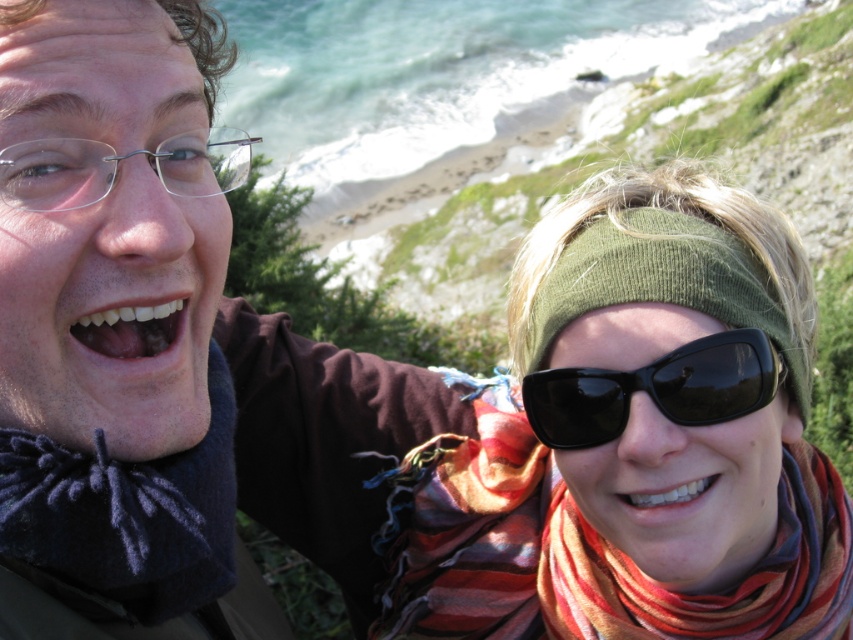
You are a photographer trying to capture a closeup shot of the white glossy teeth at center and the black plastic sunglasses at right. Which object would require you to zoom in more to fill the frame?

The white glossy teeth at center would require more zooming in because it is smaller than the black plastic sunglasses at right.

You are a photographer trying to capture a closeup of the white glossy teeth at center and the black plastic sunglasses at right. Based on their positions, which object should you focus on first if you want to ensure both are in focus?

The black plastic sunglasses at right is positioned under the white glossy teeth at center, so you should focus on the white glossy teeth at center first to ensure both are in focus.